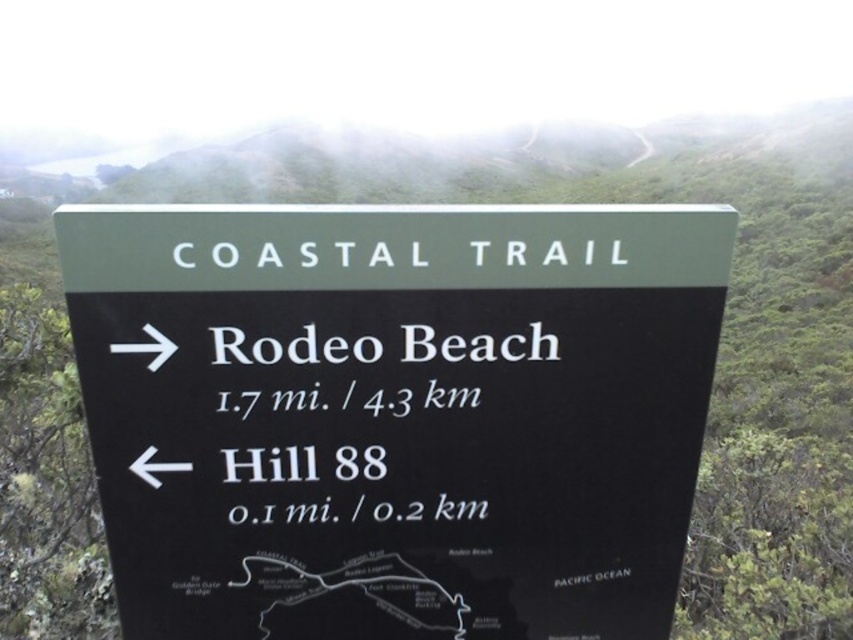
In the scene shown: Can you confirm if black plastic sign at center is smaller than white text sign at center?

Actually, black plastic sign at center might be larger than white text sign at center.

Does black plastic sign at center have a lesser width compared to white text sign at center?

No.

Image resolution: width=853 pixels, height=640 pixels. Find the location of `black plastic sign at center`. black plastic sign at center is located at coordinates (395, 413).